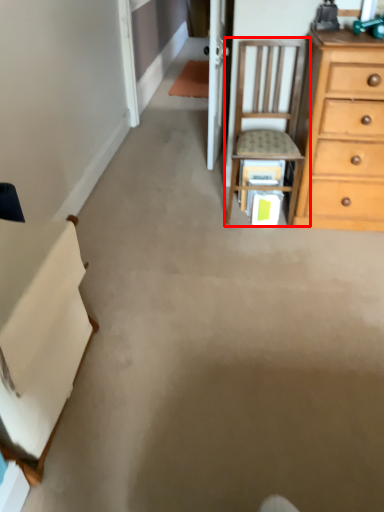
Question: From the image's perspective, what is the correct spatial positioning of chair (annotated by the red box) in reference to cabinetry?

Choices:
 (A) above
 (B) below

Answer: (A)